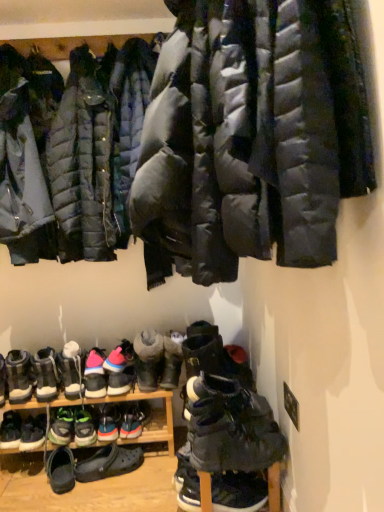
Question: From their relative heights in the image, would you say green suede sneakers at lower left, which is the thirteenth footwear in right-to-left order, is taller or shorter than gray suede boot at center, the 11th footwear viewed from the left?

Choices:
 (A) short
 (B) tall

Answer: (A)

Question: Is green suede sneakers at lower left, which ranks as the third footwear in left-to-right order, to the left or to the right of gray suede boot at center, the 11th footwear viewed from the left, in the image?

Choices:
 (A) right
 (B) left

Answer: (B)

Question: Estimate the real-world distances between objects in this image. Which object is farther from the green suede sneakers at lower left, the eleventh footwear when ordered from right to left?

Choices:
 (A) black suede sneakers at lower left, which is counted as the first footwear, starting from the left
 (B) dark gray suede boots at lower center, arranged as the fifteenth footwear when viewed from the left
 (C) black suede boots at lower center, the thirteenth footwear in the left-to-right sequence
 (D) black suede boot at lower left, the fourteenth footwear viewed from the right
 (E) matte black puffer jacket at upper center, acting as the first jacket starting from the front

Answer: (E)

Question: Which is farther from the knitted wool socks at center, which appears as the 4th footwear when viewed from the right?

Choices:
 (A) matte black puffer jacket at upper left, acting as the 2th jacket starting from the front
 (B) dark gray suede boot at lower center, the 2th footwear viewed from the right
 (C) black suede boot at lower left, the fourteenth footwear viewed from the right
 (D) matte black puffer jacket at upper center, acting as the first jacket starting from the front
 (E) multicolored fabric sneaker at center, the sixth footwear when ordered from right to left

Answer: (D)